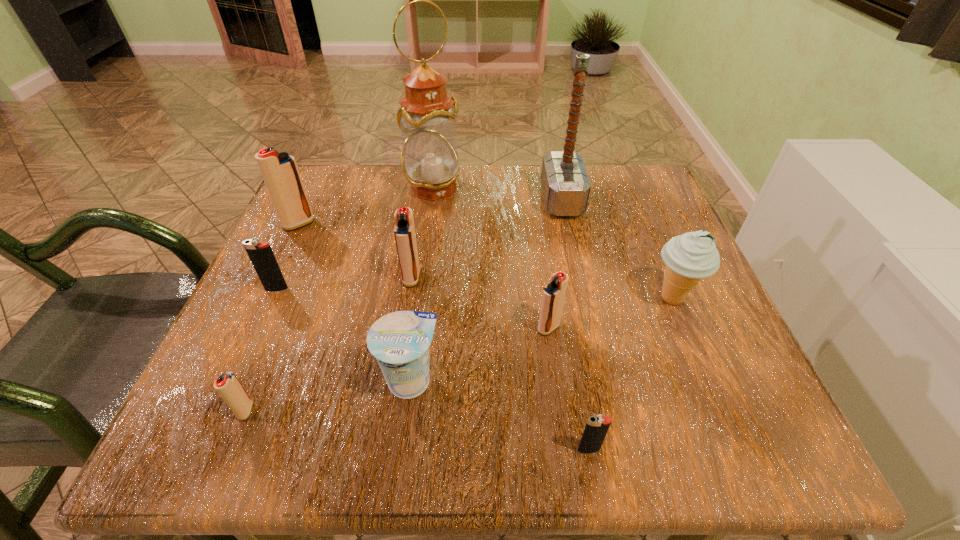
Find the location of a particular element. free spot located 0.130m on the striking surface of the brown hammer is located at coordinates pyautogui.click(x=486, y=200).

Where is `vacant space situated 0.290m on the striking surface of the brown hammer`? vacant space situated 0.290m on the striking surface of the brown hammer is located at coordinates (416, 200).

You are a GUI agent. You are given a task and a screenshot of the screen. Output one action in this format:
    pyautogui.click(x=<x>, y=<y>)
    Task: Click on the vacant region located 0.230m on the front of the biggest red igniter
    The width and height of the screenshot is (960, 540).
    Given the screenshot: What is the action you would take?
    pyautogui.click(x=255, y=315)

The height and width of the screenshot is (540, 960). In order to click on free location located on the front of the icecream in this screenshot , I will do `click(694, 351)`.

I want to click on blank area located on the front of the second farthest red igniter, so click(x=397, y=366).

At what (x,y) coordinates should I click in order to perform the action: click on vacant space situated 0.190m on the front of the farther black igniter. Please return your answer as a coordinate pair (x, y). The height and width of the screenshot is (540, 960). Looking at the image, I should click on (234, 383).

I want to click on free spot located 0.140m on the back of the third nearest igniter, so click(540, 264).

The image size is (960, 540). I want to click on free space located 0.310m on the right of the yogurt, so click(x=643, y=381).

At what (x,y) coordinates should I click in order to perform the action: click on vacant space located 0.060m on the left of the fourth igniter from right to left. Please return your answer as a coordinate pair (x, y). Image resolution: width=960 pixels, height=540 pixels. Looking at the image, I should click on coord(198,410).

The height and width of the screenshot is (540, 960). I want to click on free spot located 0.320m on the back of the nearest object, so click(x=559, y=280).